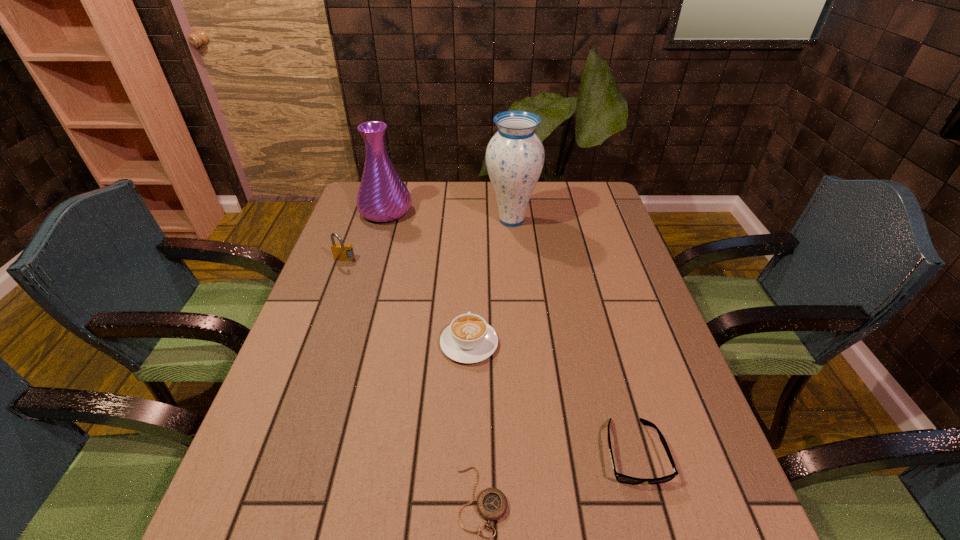
Locate an element on the screen. Image resolution: width=960 pixels, height=540 pixels. the right vase is located at coordinates (515, 155).

Identify the location of the left vase. Image resolution: width=960 pixels, height=540 pixels. (382, 196).

You are a GUI agent. You are given a task and a screenshot of the screen. Output one action in this format:
    pyautogui.click(x=<x>, y=<y>)
    Task: Click on the fourth nearest object
    This screenshot has width=960, height=540.
    Given the screenshot: What is the action you would take?
    pyautogui.click(x=341, y=252)

Where is `padlock`? This screenshot has width=960, height=540. padlock is located at coordinates (341, 252).

At what (x,y) coordinates should I click in order to perform the action: click on cappuccino. Please return your answer as a coordinate pair (x, y). The image size is (960, 540). Looking at the image, I should click on (468, 339).

Locate an element on the screen. This screenshot has height=540, width=960. the third shortest object is located at coordinates (468, 339).

The height and width of the screenshot is (540, 960). In order to click on sunglasses in this screenshot , I will do point(621,478).

This screenshot has width=960, height=540. In order to click on the fifth tallest object in this screenshot , I will do `click(621, 478)`.

The width and height of the screenshot is (960, 540). Identify the location of pocket watch. (492, 504).

This screenshot has height=540, width=960. Identify the location of blank space located 0.340m on the front of the right vase. (520, 312).